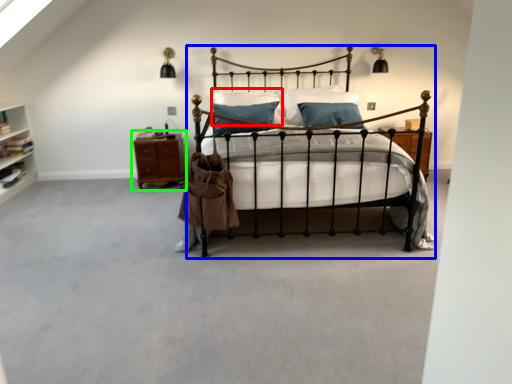
Question: Based on their relative distances, which object is nearer to pillow (highlighted by a red box)? Choose from bed (highlighted by a blue box) and nightstand (highlighted by a green box).

Choices:
 (A) bed
 (B) nightstand

Answer: (B)